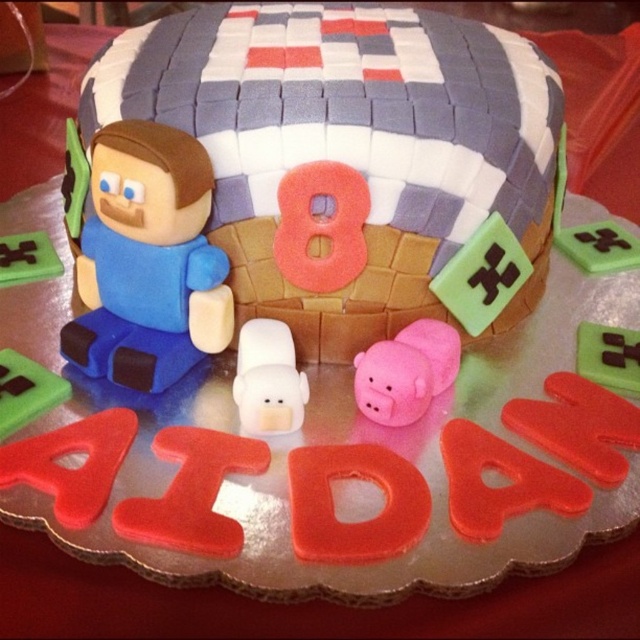
You are a guest at a Minecraft themed birthday party and see the white matte pig at center and the green matte square at lower left on the cake. Which one is closer to you?

The white matte pig at center is closer to you because it is in front of the green matte square at lower left.

You are a guest at a Minecraft themed birthday party and see the white matte pig at center and the green matte square at lower left on the cake. Which object on the cake is bigger?

The white matte pig at center is larger in size than the green matte square at lower left, so the white matte pig at center is bigger.

You are a photographer taking a picture of the Minecraft cake. You notice two points on the cake surface at coordinates point (220, 280) and point (260, 388). Which point is closer to your camera?

Point (220, 280) is further to the camera than point (260, 388), so the point closer to the camera is point (260, 388).